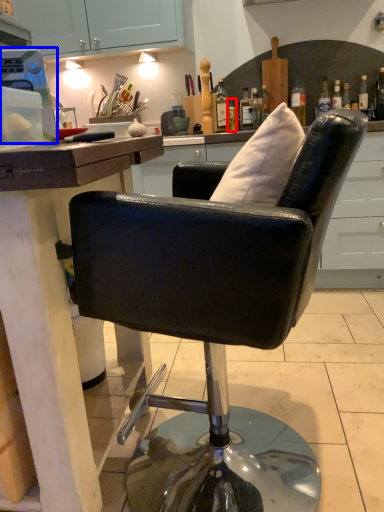
Question: Which point is further to the camera, bottle (highlighted by a red box) or appliance (highlighted by a blue box)?

Choices:
 (A) bottle
 (B) appliance

Answer: (A)